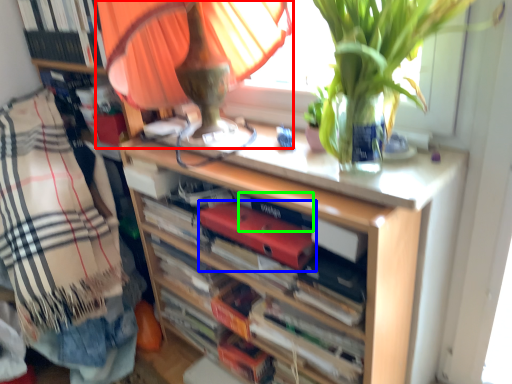
Question: Based on their relative distances, which object is nearer to table lamp (highlighted by a red box)? Choose from paperback book (highlighted by a blue box) and paperback book (highlighted by a green box).

Choices:
 (A) paperback book
 (B) paperback book

Answer: (A)